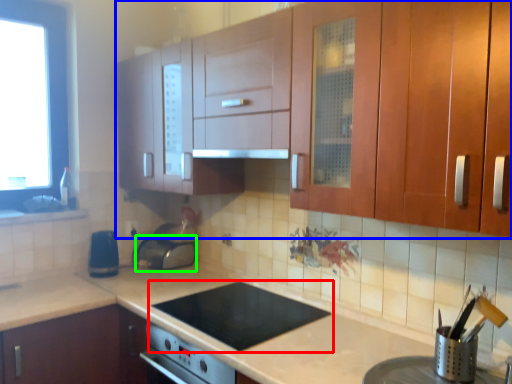
Question: Which object is the farthest from gas stove (highlighted by a red box)? Choose among these: cabinetry (highlighted by a blue box) or appliance (highlighted by a green box).

Choices:
 (A) cabinetry
 (B) appliance

Answer: (A)